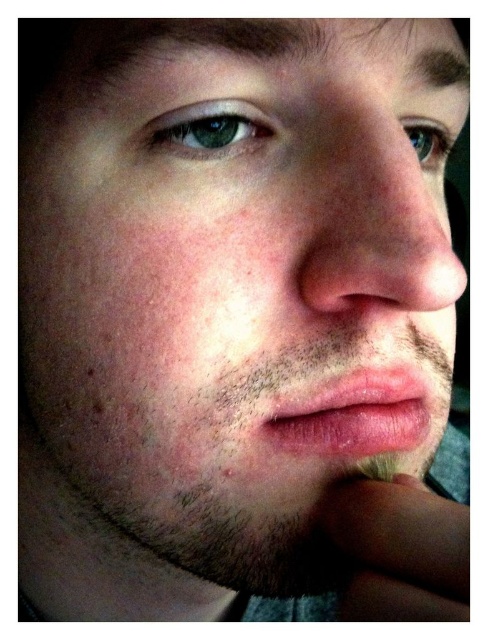
Question: Which is nearer to the dry matte lips at center?

Choices:
 (A) pink smooth nose at center
 (B) blue glossy eye at upper center

Answer: (A)

Question: Can you confirm if green matte eye at upper left is thinner than blue glossy eye at upper center?

Choices:
 (A) yes
 (B) no

Answer: (B)

Question: Does dry matte lips at center have a smaller size compared to green matte eye at upper left?

Choices:
 (A) no
 (B) yes

Answer: (A)

Question: Where is pink smooth nose at center located in relation to blue glossy eye at upper center in the image?

Choices:
 (A) below
 (B) above

Answer: (A)

Question: Which point is farther from the camera taking this photo?

Choices:
 (A) (370, 440)
 (B) (429, 141)
 (C) (248, 106)
 (D) (394, 276)

Answer: (B)

Question: Which point is farther from the camera taking this photo?

Choices:
 (A) [x=447, y=144]
 (B) [x=385, y=224]
 (C) [x=229, y=145]

Answer: (A)